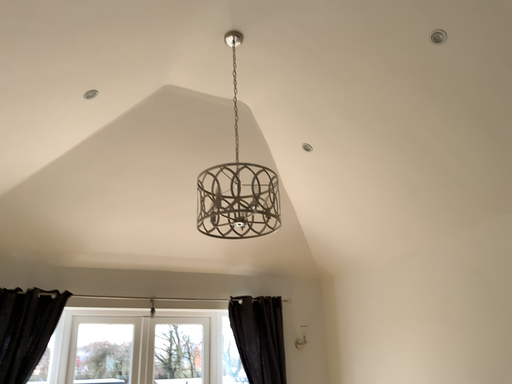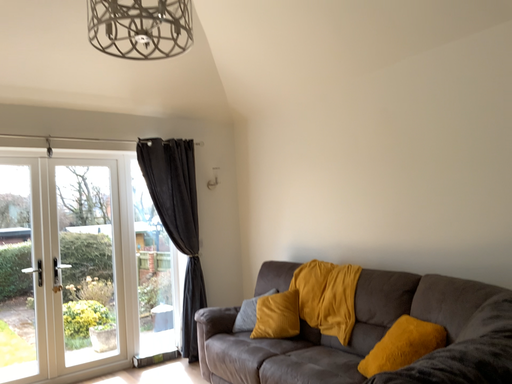
Question: Which way did the camera rotate in the video?

Choices:
 (A) rotated right
 (B) rotated left

Answer: (A)